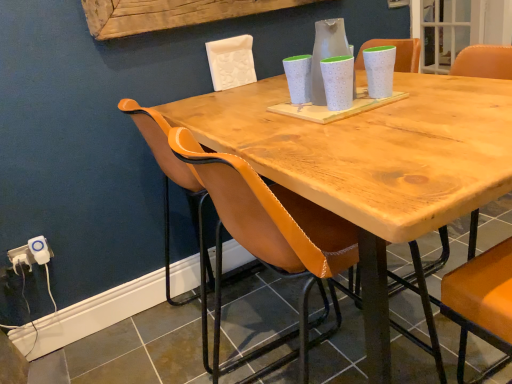
Question: Is leather at left in front of or behind white plastic electric outlet at lower left, which appears as the first electric outlet when viewed from the right, in the image?

Choices:
 (A) front
 (B) behind

Answer: (A)

Question: Is leather at left wider or thinner than white plastic electric outlet at lower left, which appears as the first electric outlet when viewed from the right?

Choices:
 (A) thin
 (B) wide

Answer: (B)

Question: Based on their relative distances, which object is nearer to the white plastic electric outlet at lower left, positioned as the 1th electric outlet in left-to-right order?

Choices:
 (A) white dotted vase at center
 (B) leather at left
 (C) white plastic electric outlet at lower left, which appears as the first electric outlet when viewed from the right

Answer: (C)

Question: Based on their relative distances, which object is nearer to the white plastic electric outlet at lower left, which appears as the first electric outlet when viewed from the right?

Choices:
 (A) white plastic electric outlet at lower left, the 2th electric outlet from the right
 (B) white dotted vase at center
 (C) leather at left

Answer: (A)